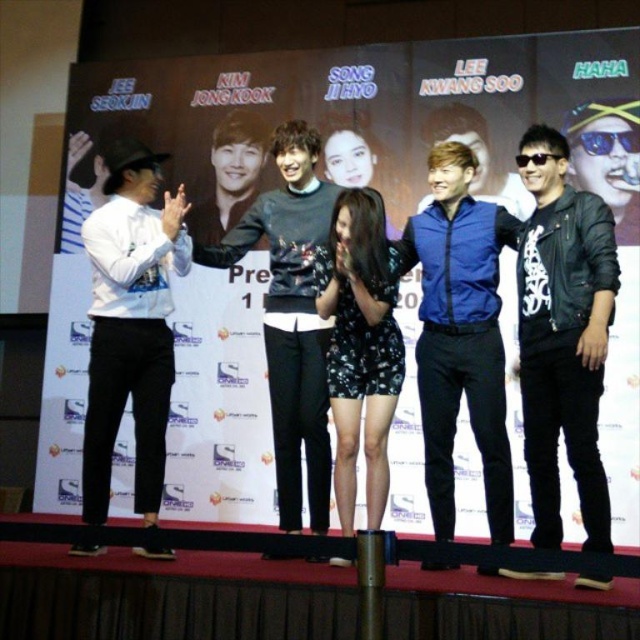
You are a photographer at the event and need to capture a photo of both the black leather jacket at right and the white matte shirt at left. The camera you are using has a maximum focus range of 7 feet. Can you photograph both items clearly in the same frame without moving the camera?

The black leather jacket at right is 7.41 feet away from the white matte shirt at left. Since the distance exceeds the camera maximum focus range of 7 feet, you cannot photograph both items clearly in the same frame without moving the camera.

You are a photographer at the event and want to ensure both the black leather jacket at right and the dark gray sweater at center are clearly visible in your photo. Since you can only adjust the camera focus on one of them, which one should you focus on to capture both details without blurring?

The black leather jacket at right has a lesser width compared to dark gray sweater at center. Therefore, focusing on the dark gray sweater at center would ensure both are in focus as it is larger and closer to the camera.